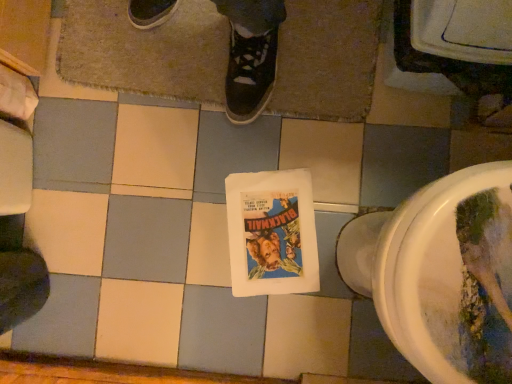
Question: Is brown textured bath mat at upper center in front of or behind white glossy toilet at lower right in the image?

Choices:
 (A) front
 (B) behind

Answer: (B)

Question: In terms of height, does brown textured bath mat at upper center look taller or shorter compared to white glossy toilet at lower right?

Choices:
 (A) tall
 (B) short

Answer: (B)

Question: Estimate the real-world distances between objects in this image. Which object is farther from the white glossy toilet at lower right?

Choices:
 (A) brown textured bath mat at upper center
 (B) matte paper comic book at center

Answer: (A)

Question: Considering the real-world distances, which object is closest to the matte paper comic book at center?

Choices:
 (A) brown textured bath mat at upper center
 (B) white glossy toilet at lower right

Answer: (B)